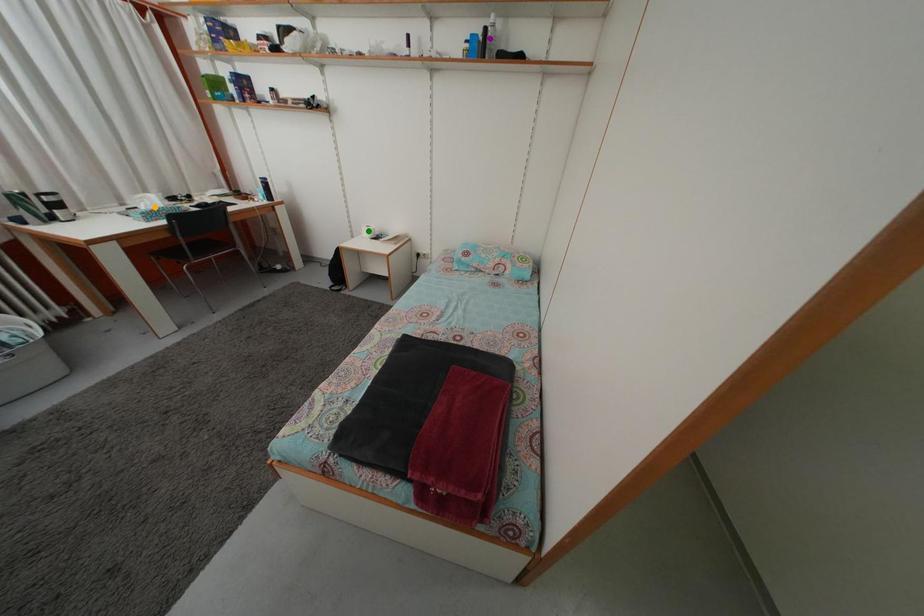
Order these from nearest to farthest:
1. green point
2. purple point
3. orange point

purple point
orange point
green point